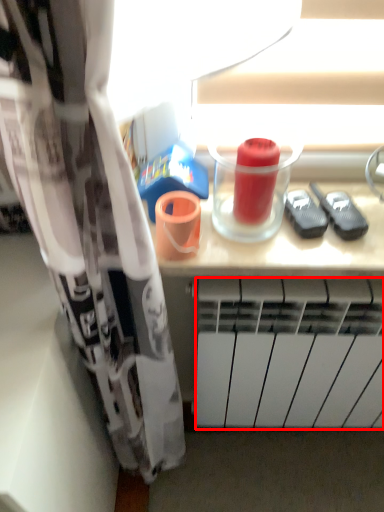
Question: From the image's perspective, what is the correct spatial positioning of radiator (annotated by the red box) in reference to beverage?

Choices:
 (A) below
 (B) above

Answer: (A)